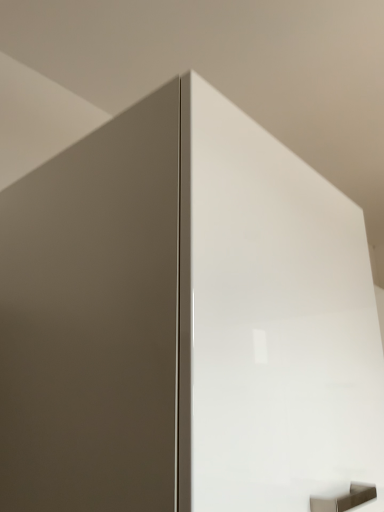
Where is `matte white door at center`? The image size is (384, 512). matte white door at center is located at coordinates (271, 324).

This screenshot has width=384, height=512. What do you see at coordinates (271, 324) in the screenshot? I see `matte white door at center` at bounding box center [271, 324].

This screenshot has width=384, height=512. Find the location of `matte white door at center`. matte white door at center is located at coordinates (271, 324).